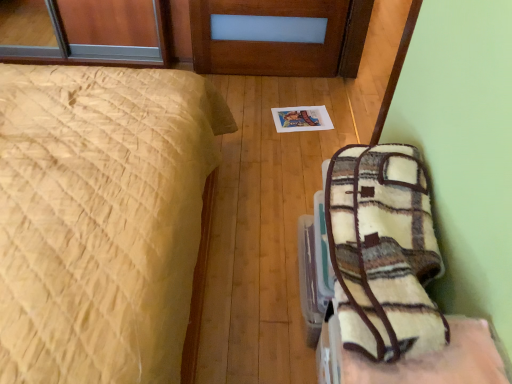
Question: Is white fuzzy blanket at lower right far from plush fleece blanket at lower right?

Choices:
 (A) no
 (B) yes

Answer: (A)

Question: Considering the relative sizes of white fuzzy blanket at lower right and plush fleece blanket at lower right in the image provided, is white fuzzy blanket at lower right smaller than plush fleece blanket at lower right?

Choices:
 (A) no
 (B) yes

Answer: (A)

Question: Is white fuzzy blanket at lower right not inside plush fleece blanket at lower right?

Choices:
 (A) no
 (B) yes

Answer: (B)

Question: Is white fuzzy blanket at lower right behind plush fleece blanket at lower right?

Choices:
 (A) no
 (B) yes

Answer: (A)

Question: Considering the relative positions of white fuzzy blanket at lower right and plush fleece blanket at lower right in the image provided, is white fuzzy blanket at lower right to the right of plush fleece blanket at lower right from the viewer's perspective?

Choices:
 (A) no
 (B) yes

Answer: (B)

Question: Considering the positions of plush fleece blanket at lower right and white fuzzy blanket at lower right in the image, is plush fleece blanket at lower right bigger or smaller than white fuzzy blanket at lower right?

Choices:
 (A) small
 (B) big

Answer: (A)

Question: Considering the relative positions of plush fleece blanket at lower right and white fuzzy blanket at lower right in the image provided, is plush fleece blanket at lower right to the left or to the right of white fuzzy blanket at lower right?

Choices:
 (A) right
 (B) left

Answer: (B)

Question: Considering the positions of plush fleece blanket at lower right and white fuzzy blanket at lower right in the image, is plush fleece blanket at lower right wider or thinner than white fuzzy blanket at lower right?

Choices:
 (A) thin
 (B) wide

Answer: (B)

Question: In terms of height, does plush fleece blanket at lower right look taller or shorter compared to white fuzzy blanket at lower right?

Choices:
 (A) short
 (B) tall

Answer: (B)

Question: Would you say yellow quilted bed at left is inside or outside plush fleece blanket at lower right?

Choices:
 (A) inside
 (B) outside

Answer: (B)

Question: Considering the relative positions of yellow quilted bed at left and plush fleece blanket at lower right in the image provided, is yellow quilted bed at left to the left or to the right of plush fleece blanket at lower right?

Choices:
 (A) left
 (B) right

Answer: (A)

Question: Is yellow quilted bed at left taller or shorter than plush fleece blanket at lower right?

Choices:
 (A) tall
 (B) short

Answer: (A)

Question: From the image's perspective, is yellow quilted bed at left positioned above or below plush fleece blanket at lower right?

Choices:
 (A) above
 (B) below

Answer: (A)

Question: From their relative heights in the image, would you say white fuzzy blanket at lower right is taller or shorter than plush fleece blanket at lower right?

Choices:
 (A) short
 (B) tall

Answer: (A)

Question: In the image, is white fuzzy blanket at lower right positioned in front of or behind plush fleece blanket at lower right?

Choices:
 (A) front
 (B) behind

Answer: (A)